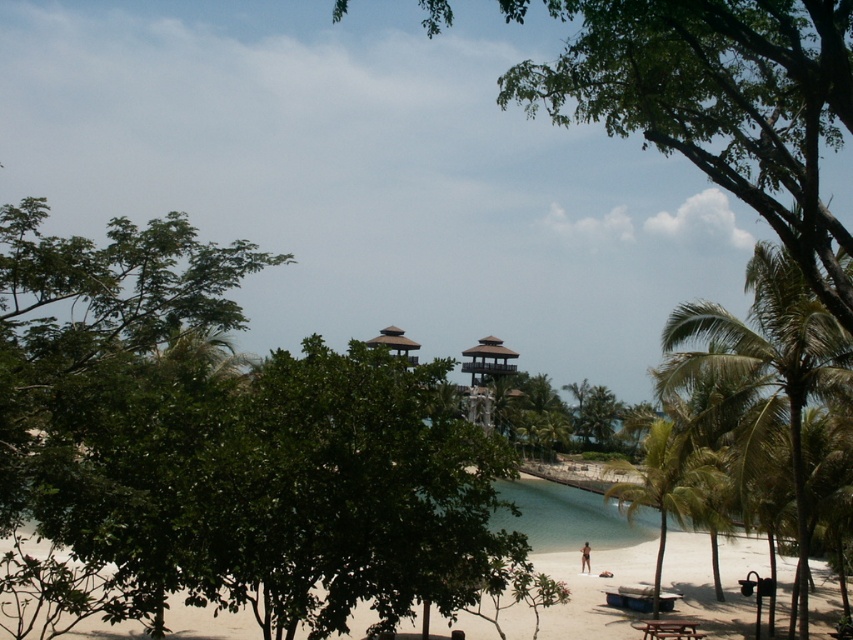
Question: From the image, what is the correct spatial relationship of wooden gazebo at center in relation to brown skin at lower center?

Choices:
 (A) right
 (B) left

Answer: (B)

Question: Considering the real-world distances, which object is farthest from the brown skin at lower center?

Choices:
 (A) wooden gazebo at center
 (B) green leafy palm tree at right
 (C) clear water at beach center
 (D) green leafy palm tree at lower right

Answer: (A)

Question: Which object is closer to the camera taking this photo?

Choices:
 (A) green leafy palm tree at lower right
 (B) clear water at beach center

Answer: (A)

Question: In this image, where is green leafy palm tree at right located relative to clear water at beach center?

Choices:
 (A) above
 (B) below

Answer: (A)

Question: Which point is farther to the camera?

Choices:
 (A) brown skin at lower center
 (B) green leafy palm tree at lower right
 (C) green leafy palm tree at right
 (D) clear water at beach center

Answer: (D)

Question: Is clear water at beach center above wooden gazebo at center?

Choices:
 (A) no
 (B) yes

Answer: (A)